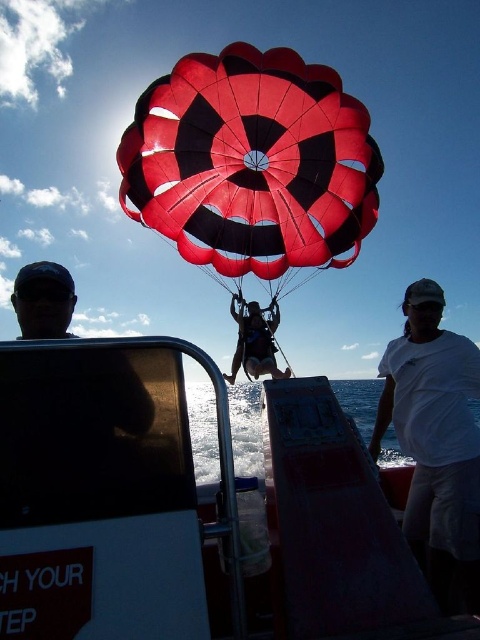
You are a photographer on the boat trying to capture the parasailers. You notice the white cotton shirt at center and the matte black wetsuit at center. Which one is closer to the camera based on their positions?

The white cotton shirt at center is located below the matte black wetsuit at center, so the matte black wetsuit at center is closer to the camera.